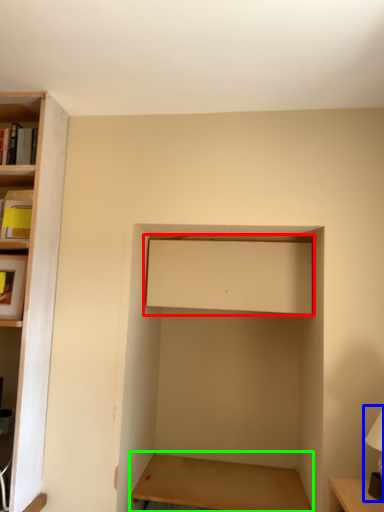
Question: Based on their relative distances, which object is nearer to cabinet (highlighted by a red box)? Choose from table lamp (highlighted by a blue box) and table (highlighted by a green box).

Choices:
 (A) table lamp
 (B) table

Answer: (A)